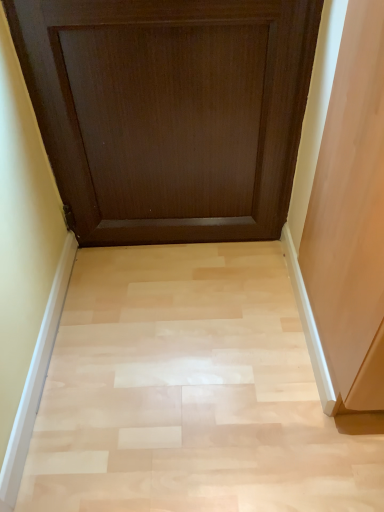
Image resolution: width=384 pixels, height=512 pixels. Identify the location of light wood floor at center. (191, 392).

The image size is (384, 512). What do you see at coordinates (191, 392) in the screenshot?
I see `light wood floor at center` at bounding box center [191, 392].

This screenshot has height=512, width=384. What do you see at coordinates (169, 112) in the screenshot?
I see `dark wood door at upper center` at bounding box center [169, 112].

I want to click on dark wood door at upper center, so click(169, 112).

Identify the location of light wood floor at center. The height and width of the screenshot is (512, 384). (191, 392).

In the image, is dark wood door at upper center on the left side or the right side of light wood floor at center?

In the image, dark wood door at upper center appears on the left side of light wood floor at center.

Relative to light wood floor at center, is dark wood door at upper center in front or behind?

dark wood door at upper center is positioned closer to the viewer than light wood floor at center.

Between point (95, 244) and point (324, 425), which one is positioned behind?

The point (95, 244) is farther.

From the image's perspective, does dark wood door at upper center appear lower than light wood floor at center?

No.

From a real-world perspective, who is located lower, dark wood door at upper center or light wood floor at center?

From a 3D spatial view, light wood floor at center is below.

Between dark wood door at upper center and light wood floor at center, which one has smaller width?

With smaller width is dark wood door at upper center.

Who is shorter, dark wood door at upper center or light wood floor at center?

Standing shorter between the two is light wood floor at center.

Does dark wood door at upper center have a smaller size compared to light wood floor at center?

No, dark wood door at upper center is not smaller than light wood floor at center.

Is dark wood door at upper center situated inside light wood floor at center or outside?

dark wood door at upper center is spatially situated outside light wood floor at center.

Is dark wood door at upper center in contact with light wood floor at center?

dark wood door at upper center and light wood floor at center are not in contact.

Based on the photo, is dark wood door at upper center facing away from light wood floor at center?

No, dark wood door at upper center's orientation is not away from light wood floor at center.

Based on the photo, how many degrees apart are the facing directions of dark wood door at upper center and light wood floor at center?

The angular difference between dark wood door at upper center and light wood floor at center is 90.5 degrees.

There is a light wood floor at center. Find the location of `door above it (from a real-world perspective)`. door above it (from a real-world perspective) is located at coordinates (169, 112).

Which object is positioned more to the left, light wood floor at center or dark wood door at upper center?

Positioned to the left is dark wood door at upper center.

Relative to dark wood door at upper center, is light wood floor at center in front or behind?

Visually, light wood floor at center is located behind dark wood door at upper center.

Which is farther, (34, 463) or (219, 153)?

The point (219, 153) is behind.

From the image's perspective, relative to dark wood door at upper center, is light wood floor at center above or below?

From the image's perspective, light wood floor at center appears below dark wood door at upper center.

From a real-world perspective, which object rests below the other?

light wood floor at center is physically lower.

Can you confirm if light wood floor at center is thinner than dark wood door at upper center?

No, light wood floor at center is not thinner than dark wood door at upper center.

Considering the sizes of objects light wood floor at center and dark wood door at upper center in the image provided, who is taller, light wood floor at center or dark wood door at upper center?

dark wood door at upper center.

Does light wood floor at center have a larger size compared to dark wood door at upper center?

No, light wood floor at center is not bigger than dark wood door at upper center.

Is light wood floor at center spatially inside dark wood door at upper center, or outside of it?

light wood floor at center is not enclosed by dark wood door at upper center.

Is light wood floor at center beside dark wood door at upper center?

No, light wood floor at center is not beside dark wood door at upper center.

Is dark wood door at upper center at the back of light wood floor at center?

light wood floor at center does not have its back to dark wood door at upper center.

How different are the orientations of light wood floor at center and dark wood door at upper center in degrees?

They differ by 90.5 degrees in their facing directions.

Where is `plain that appears behind the dark wood door at upper center`? Image resolution: width=384 pixels, height=512 pixels. plain that appears behind the dark wood door at upper center is located at coordinates (191, 392).

Where is `door on the left of light wood floor at center`? door on the left of light wood floor at center is located at coordinates (169, 112).

Where is `plain on the right side of dark wood door at upper center`? This screenshot has width=384, height=512. plain on the right side of dark wood door at upper center is located at coordinates (191, 392).